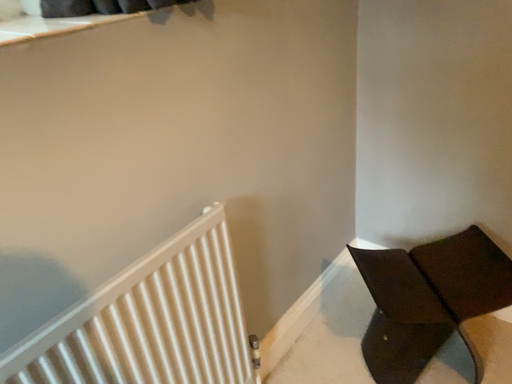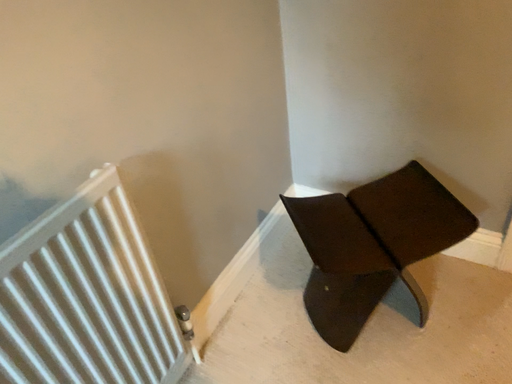
Question: Which way did the camera rotate in the video?

Choices:
 (A) rotated upward
 (B) rotated downward

Answer: (B)